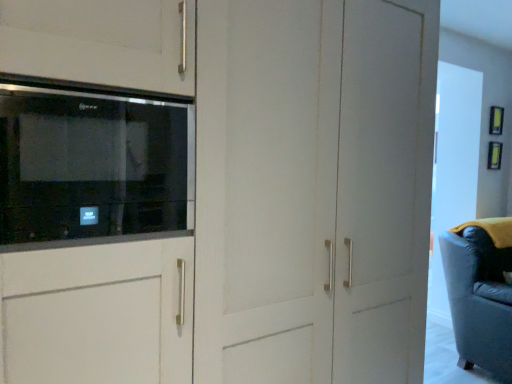
Identify the location of black glass microwave at upper left. The image size is (512, 384). (92, 165).

Describe the element at coordinates (92, 165) in the screenshot. I see `black glass microwave at upper left` at that location.

The image size is (512, 384). What do you see at coordinates (480, 293) in the screenshot? I see `leather swivel chair at right` at bounding box center [480, 293].

Where is `leather swivel chair at right`? leather swivel chair at right is located at coordinates (480, 293).

At what (x,y) coordinates should I click in order to perform the action: click on black glass microwave at upper left. Please return your answer as a coordinate pair (x, y). This screenshot has width=512, height=384. Looking at the image, I should click on (92, 165).

Can you confirm if leather swivel chair at right is positioned to the right of black glass microwave at upper left?

Yes.

Is the depth of leather swivel chair at right greater than that of black glass microwave at upper left?

Yes, leather swivel chair at right is further from the camera.

Which is more distant, (483,256) or (69,179)?

Positioned behind is point (483,256).

From the image's perspective, which is above, leather swivel chair at right or black glass microwave at upper left?

black glass microwave at upper left is shown above in the image.

From a real-world perspective, is leather swivel chair at right over black glass microwave at upper left?

No.

Between leather swivel chair at right and black glass microwave at upper left, which one has smaller width?

With smaller width is black glass microwave at upper left.

Is leather swivel chair at right taller or shorter than black glass microwave at upper left?

Clearly, leather swivel chair at right is taller compared to black glass microwave at upper left.

Looking at the image, does leather swivel chair at right seem bigger or smaller compared to black glass microwave at upper left?

Clearly, leather swivel chair at right is larger in size than black glass microwave at upper left.

Is leather swivel chair at right located outside black glass microwave at upper left?

Yes.

Are leather swivel chair at right and black glass microwave at upper left far apart?

Yes, leather swivel chair at right and black glass microwave at upper left are quite far apart.

Is leather swivel chair at right looking in the opposite direction of black glass microwave at upper left?

leather swivel chair at right is not turned away from black glass microwave at upper left.

How distant is leather swivel chair at right from black glass microwave at upper left?

leather swivel chair at right is 2.41 meters from black glass microwave at upper left.

Image resolution: width=512 pixels, height=384 pixels. I want to click on swivel chair to the right of black glass microwave at upper left, so click(480, 293).

Considering the positions of objects black glass microwave at upper left and leather swivel chair at right in the image provided, who is more to the right, black glass microwave at upper left or leather swivel chair at right?

From the viewer's perspective, leather swivel chair at right appears more on the right side.

Is black glass microwave at upper left positioned behind leather swivel chair at right?

No, the depth of black glass microwave at upper left is less than that of leather swivel chair at right.

Which point is more forward, (124, 153) or (507, 300)?

Positioned in front is point (124, 153).

From the image's perspective, which is below, black glass microwave at upper left or leather swivel chair at right?

From the image's view, leather swivel chair at right is below.

From a real-world perspective, which object rests below the other?

leather swivel chair at right, from a real-world perspective.

Can you confirm if black glass microwave at upper left is wider than leather swivel chair at right?

Incorrect, the width of black glass microwave at upper left does not surpass that of leather swivel chair at right.

Who is taller, black glass microwave at upper left or leather swivel chair at right?

leather swivel chair at right.

Considering the sizes of objects black glass microwave at upper left and leather swivel chair at right in the image provided, who is bigger, black glass microwave at upper left or leather swivel chair at right?

Bigger between the two is leather swivel chair at right.

Is leather swivel chair at right completely or partially inside black glass microwave at upper left?

No, black glass microwave at upper left does not contain leather swivel chair at right.

Are black glass microwave at upper left and leather swivel chair at right beside each other?

No, black glass microwave at upper left is not with leather swivel chair at right.

Based on the photo, is black glass microwave at upper left facing away from leather swivel chair at right?

No.

The image size is (512, 384). In the image, there is a black glass microwave at upper left. Identify the location of swivel chair below it (from the image's perspective). (480, 293).

The image size is (512, 384). Identify the location of swivel chair lying below the black glass microwave at upper left (from the image's perspective). (480, 293).

In order to click on microwave oven to the left of leather swivel chair at right in this screenshot , I will do `click(92, 165)`.